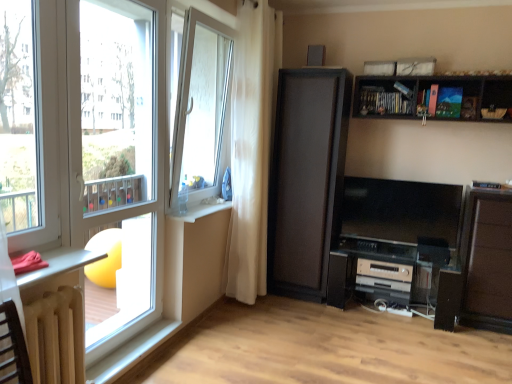
This screenshot has width=512, height=384. In order to click on free space in front of matte black cabinet at lower right in this screenshot , I will do `click(488, 344)`.